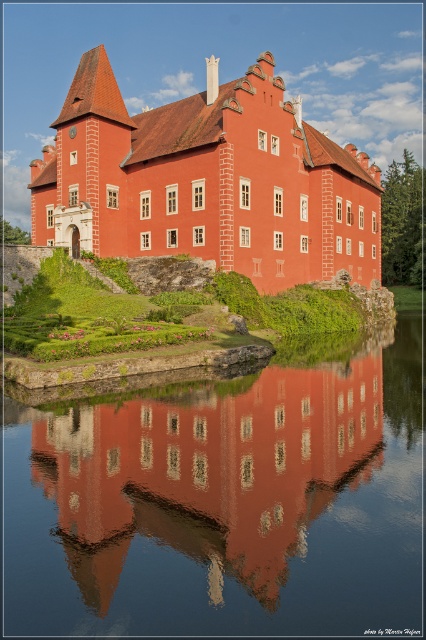
You are standing at the point labeled point [363,282] and want to walk towards the castle. Is the point labeled point [284,499] located in front of or behind you relative to your direction of travel?

Point [284,499] is in front of point [363,282], so if you are facing the castle, the point labeled point [284,499] would be in front of you relative to your position at point [363,282].

You are standing on the grassy area behind the matte red stone castle at center and want to take a photo of it. To avoid the reflection of the smooth glass water at center, where should you position yourself?

You should position yourself behind the matte red stone castle at center, away from the smooth glass water at center since the water is in front of the castle and could reflect sunlight, which might interfere with the photo.